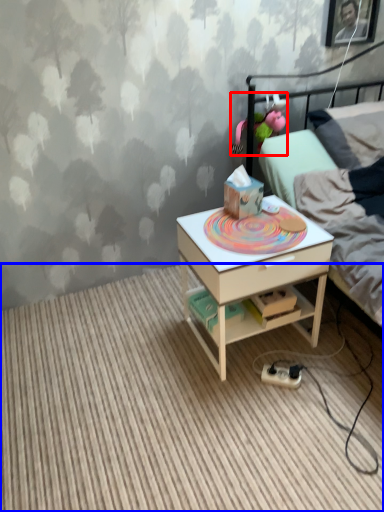
Question: Among these objects, which one is farthest to the camera, toy (highlighted by a red box) or plain (highlighted by a blue box)?

Choices:
 (A) toy
 (B) plain

Answer: (A)